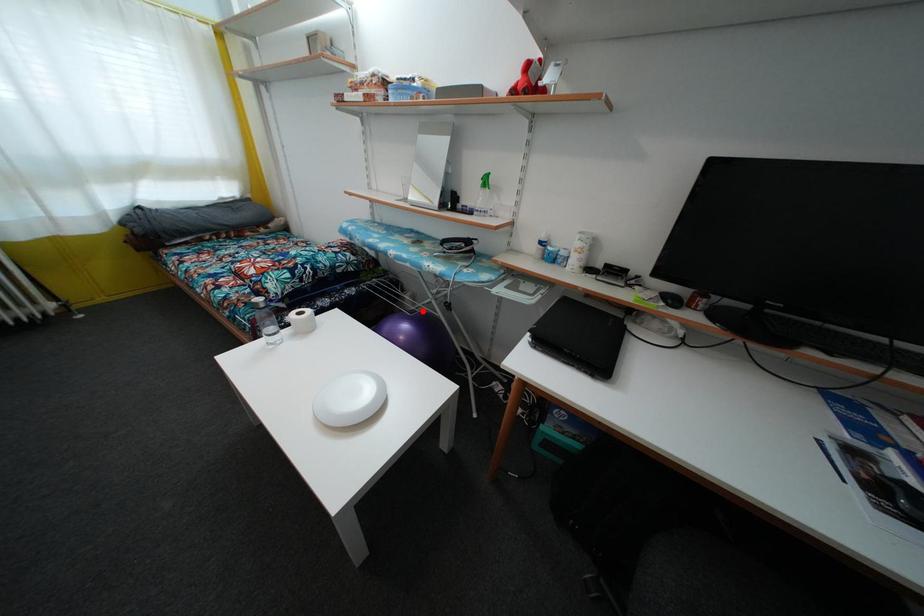
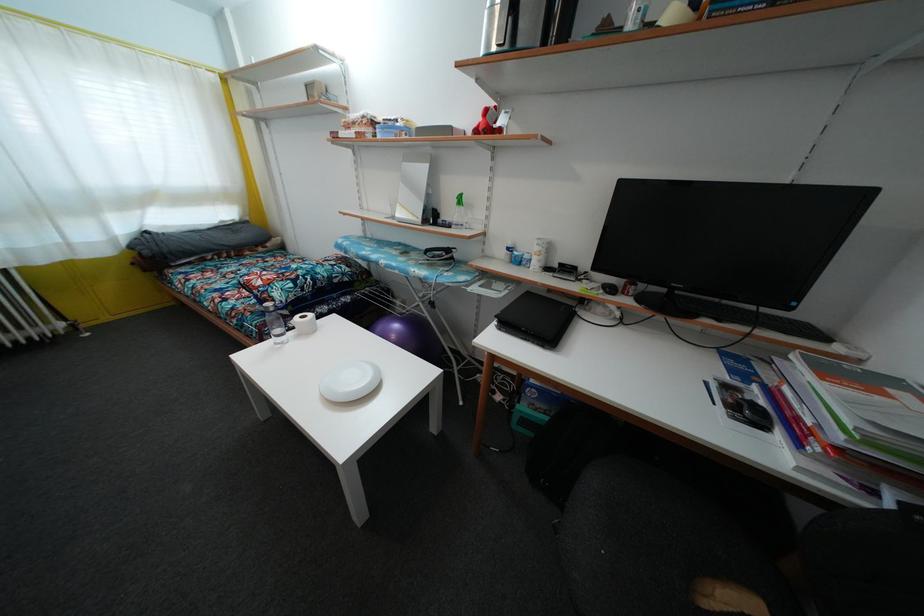
Where in the second image is the point corresponding to the highlighted location from the first image?

(411, 315)